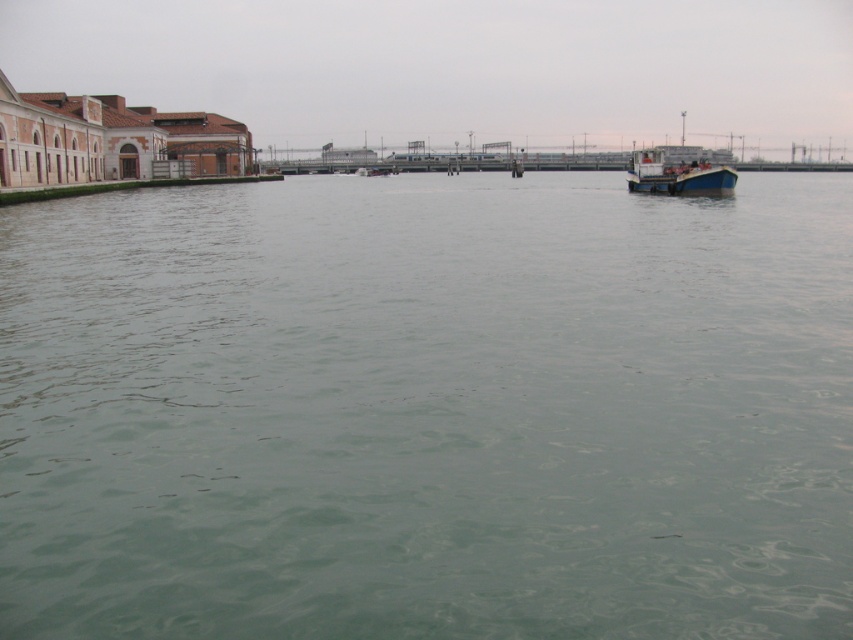
Which of these two, green water at center or wooden boat at right, stands shorter?

green water at center

Is point (785, 275) farther from camera compared to point (651, 161)?

No, it is not.

Locate an element on the screen. green water at center is located at coordinates (428, 410).